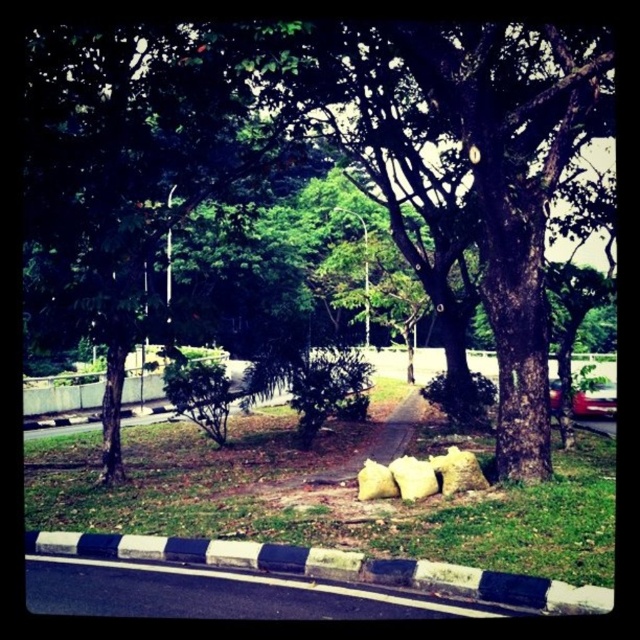
Is point (180, 422) positioned behind point (595, 410)?

Yes, point (180, 422) is behind point (595, 410).

Is green grass at lower center in front of metallic red car at center-right?

That is True.

Who is more forward, (186, 529) or (579, 401)?

Point (186, 529) is more forward.

The width and height of the screenshot is (640, 640). In order to click on green grass at lower center in this screenshot , I will do `click(323, 497)`.

Between brown rough tree at center and black and white concrete curb at lower center, which one is positioned higher?

brown rough tree at center is above.

Based on the photo, can you confirm if brown rough tree at center is bigger than black and white concrete curb at lower center?

Indeed, brown rough tree at center has a larger size compared to black and white concrete curb at lower center.

Measure the distance between point (x=516, y=195) and camera.

The distance of point (x=516, y=195) from camera is 7.36 meters.

Locate an element on the screen. The height and width of the screenshot is (640, 640). brown rough tree at center is located at coordinates (342, 152).

Who is lower down, black and white concrete curb at lower center or metallic red car at center-right?

black and white concrete curb at lower center

Who is positioned more to the left, black and white concrete curb at lower center or metallic red car at center-right?

Positioned to the left is black and white concrete curb at lower center.

Does point (86, 538) lie behind point (582, 390)?

No, (86, 538) is closer to viewer.

Locate an element on the screen. This screenshot has width=640, height=640. black and white concrete curb at lower center is located at coordinates (330, 568).